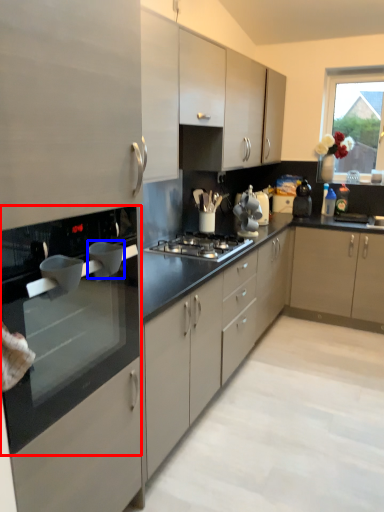
Question: Which point is further to the camera, countertop (highlighted by a red box) or appliance (highlighted by a blue box)?

Choices:
 (A) countertop
 (B) appliance

Answer: (B)